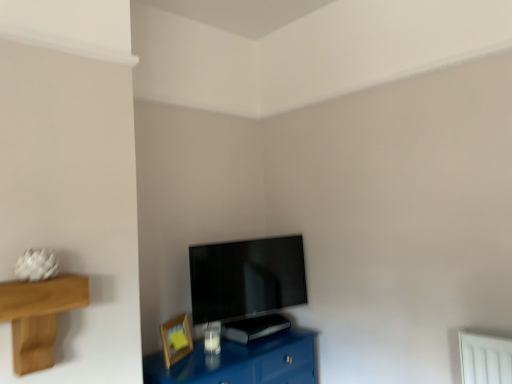
Identify the location of empty space that is to the right of wooden picture frame at lower left. The height and width of the screenshot is (384, 512). (221, 356).